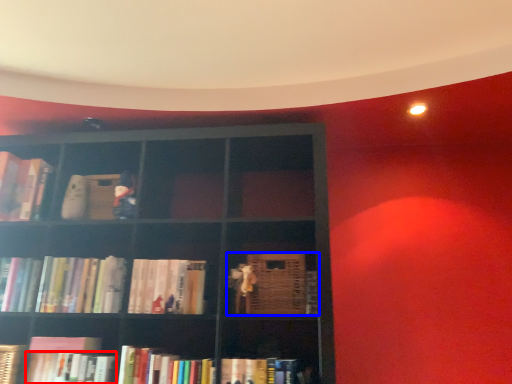
Question: Which object is closer to the camera taking this photo, book (highlighted by a red box) or book (highlighted by a blue box)?

Choices:
 (A) book
 (B) book

Answer: (A)